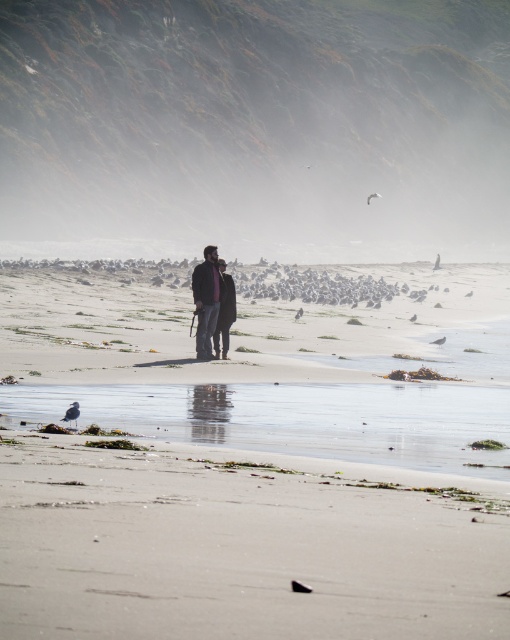
Question: Does smooth sand at lower center come behind matte black jacket at center?

Choices:
 (A) yes
 (B) no

Answer: (B)

Question: Does smooth sand at lower center appear on the left side of matte black jacket at center?

Choices:
 (A) no
 (B) yes

Answer: (A)

Question: Estimate the real-world distances between objects in this image. Which object is closer to the smooth sand at lower center?

Choices:
 (A) foggy mist at upper center
 (B) matte black jacket at center

Answer: (B)

Question: Among these objects, which one is farthest from the camera?

Choices:
 (A) smooth sand at lower center
 (B) foggy mist at upper center
 (C) matte black jacket at center

Answer: (B)

Question: Observing the image, what is the correct spatial positioning of foggy mist at upper center in reference to smooth sand at lower center?

Choices:
 (A) below
 (B) above

Answer: (B)

Question: Among these points, which one is farthest from the camera?

Choices:
 (A) 211,257
 (B) 220,150
 (C) 451,572

Answer: (B)